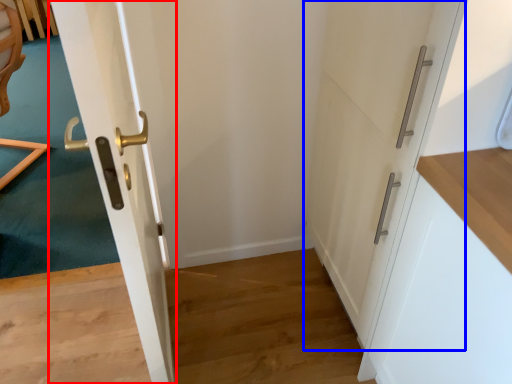
Question: Which of the following is the closest to the observer, door (highlighted by a red box) or door (highlighted by a blue box)?

Choices:
 (A) door
 (B) door

Answer: (A)